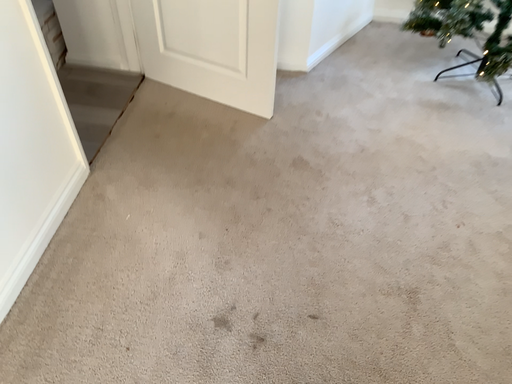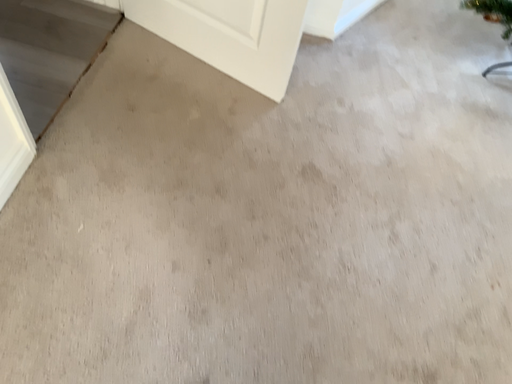
Question: How did the camera likely rotate when shooting the video?

Choices:
 (A) rotated downward
 (B) rotated upward

Answer: (A)